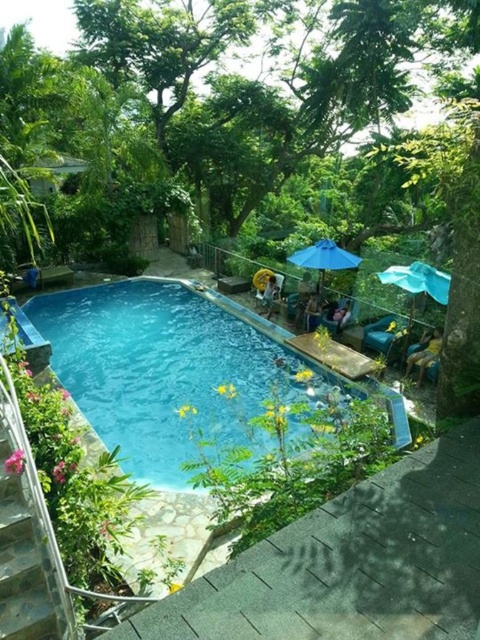
Looking at this image, you are planning to set up a new umbrella in the pool area. The blue fabric umbrella at upper right and the blue fabric umbrella at center are already present. Which existing umbrella should you choose to match the size of the new one if you want the new umbrella to be larger than both?

You should choose the blue fabric umbrella at upper right because it is already bigger than the blue fabric umbrella at center, so the new umbrella can be larger than both by being bigger than the upper right one.